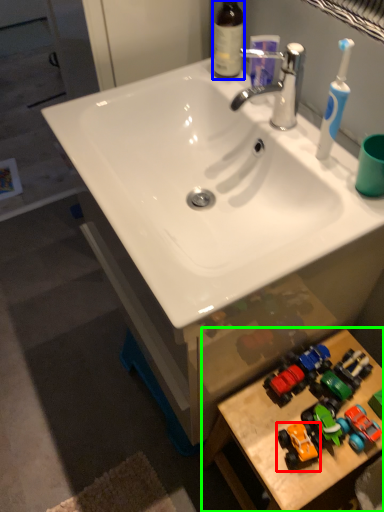
Question: Considering the real-world distances, which object is farthest from toy (highlighted by a red box)? bottle (highlighted by a blue box) or table (highlighted by a green box)?

Choices:
 (A) bottle
 (B) table

Answer: (A)